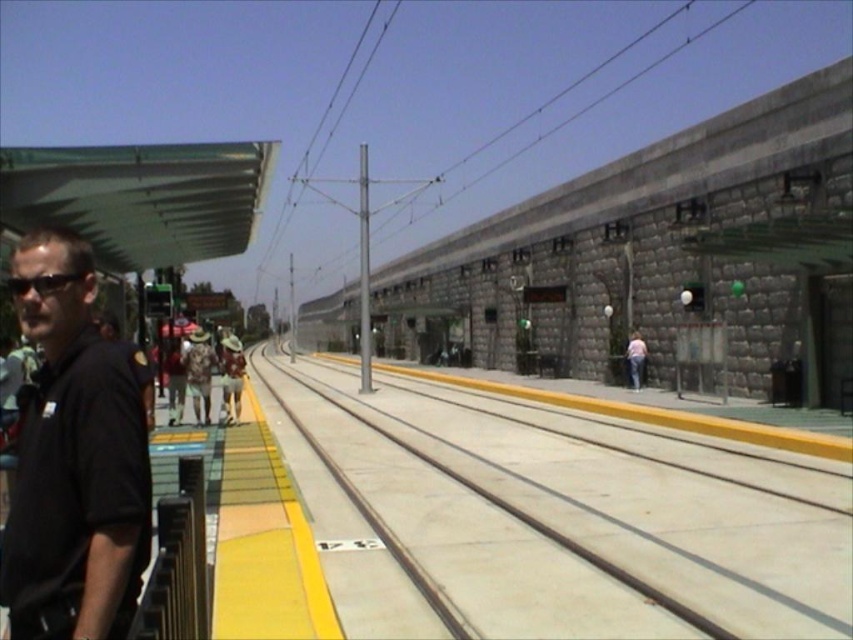
Question: Does gray stone train at center appear under black matte shirt at left?

Choices:
 (A) no
 (B) yes

Answer: (A)

Question: Among these points, which one is nearest to the camera?

Choices:
 (A) (476, 326)
 (B) (309, 596)
 (C) (639, 365)

Answer: (B)

Question: Considering the relative positions of concrete at center and light blue jeans at center in the image provided, where is concrete at center located with respect to light blue jeans at center?

Choices:
 (A) left
 (B) right

Answer: (A)

Question: Can you confirm if concrete at center is positioned above yellow rubber platform at left?

Choices:
 (A) yes
 (B) no

Answer: (B)

Question: Among these points, which one is farthest from the camera?

Choices:
 (A) (708, 385)
 (B) (641, 346)
 (C) (265, 566)

Answer: (B)

Question: Which object is positioned closest to the camouflage fabric shirt at center?

Choices:
 (A) gray stone train at center
 (B) black matte shirt at left

Answer: (B)